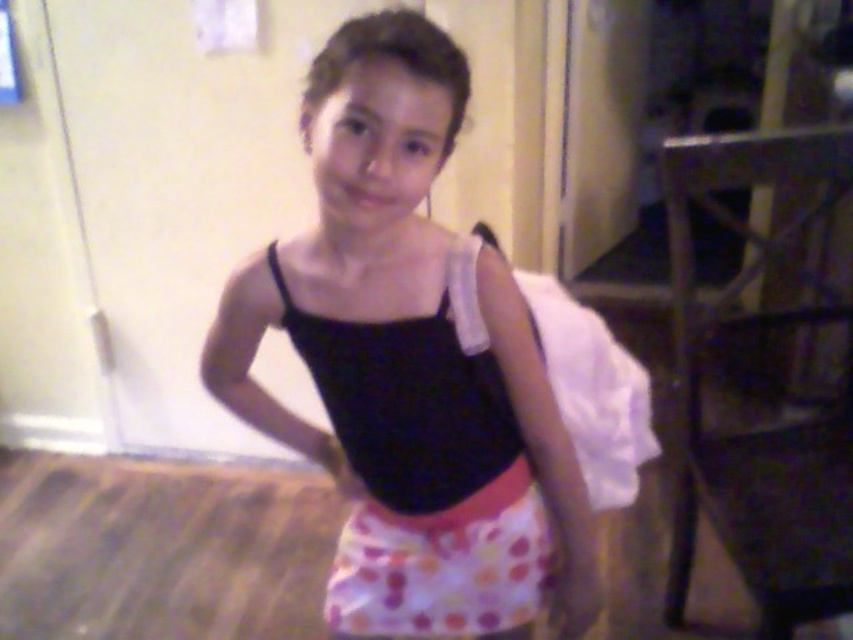
Can you confirm if matte black leotard at center is positioned above polka dot fabric skirt at center?

Yes.

In the scene shown: Between matte black leotard at center and polka dot fabric skirt at center, which one is positioned lower?

polka dot fabric skirt at center

Is point (521, 492) behind point (345, 602)?

No.

What are the coordinates of `matte black leotard at center` in the screenshot? It's located at (410, 364).

From the picture: Who is more forward, (x=352, y=612) or (x=360, y=419)?

Point (x=360, y=419) is more forward.

Find the location of a particular element. matte black leotard at center is located at coordinates (410, 364).

Is point (515, 600) positioned in front of point (514, 577)?

No.

Who is shorter, black spandex leotard at center or polka dot fabric skirt at center?

Standing shorter between the two is polka dot fabric skirt at center.

Is point (492, 401) less distant than point (485, 564)?

Yes, point (492, 401) is in front of point (485, 564).

The width and height of the screenshot is (853, 640). I want to click on black spandex leotard at center, so click(424, 472).